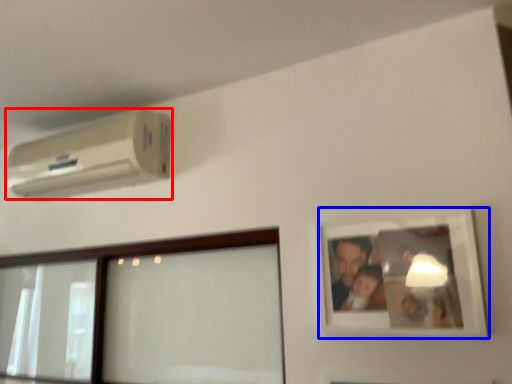
Question: Which object is closer to the camera taking this photo, air conditioning (highlighted by a red box) or picture frame (highlighted by a blue box)?

Choices:
 (A) air conditioning
 (B) picture frame

Answer: (B)